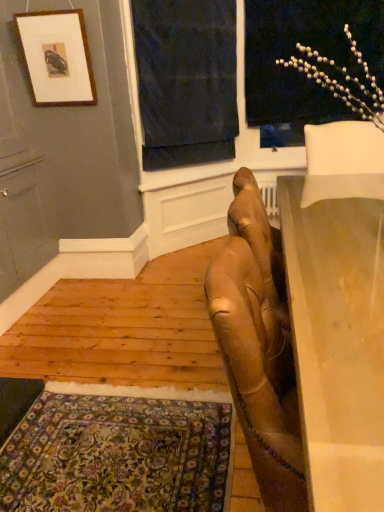
Question: In the image, is carpeted rug at lower left positioned in front of or behind smooth beige table at right?

Choices:
 (A) behind
 (B) front

Answer: (A)

Question: From a real-world perspective, is carpeted rug at lower left above or below smooth beige table at right?

Choices:
 (A) above
 (B) below

Answer: (B)

Question: Which is farther from the white matte floral arrangement at upper right?

Choices:
 (A) matte wooden picture frame at upper left
 (B) smooth beige table at right
 (C) carpeted rug at lower left
 (D) dark blue fabric at upper center

Answer: (C)

Question: Estimate the real-world distances between objects in this image. Which object is farther from the white matte floral arrangement at upper right?

Choices:
 (A) dark blue fabric at upper center
 (B) smooth beige table at right
 (C) carpeted rug at lower left
 (D) matte wooden picture frame at upper left

Answer: (C)